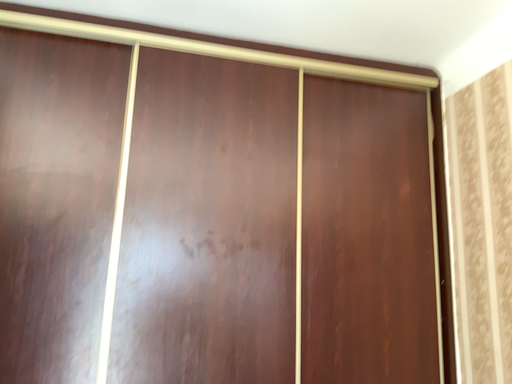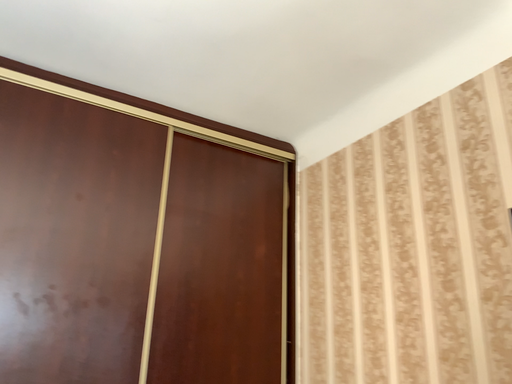
Question: How did the camera likely rotate when shooting the video?

Choices:
 (A) rotated downward
 (B) rotated upward

Answer: (B)